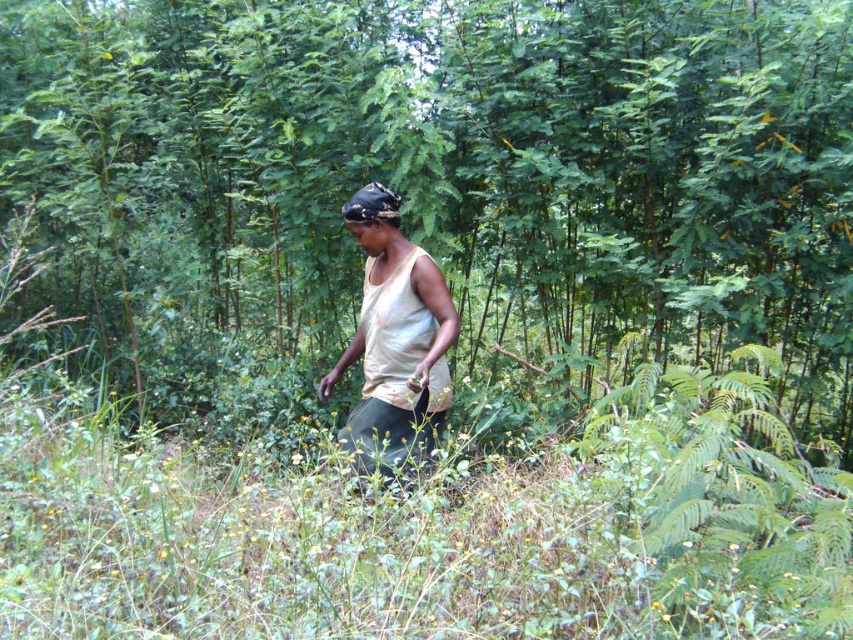
Between green leafy tree at center and white cotton tank top at center, which one is positioned higher?

green leafy tree at center is higher up.

Locate an element on the screen. green leafy tree at center is located at coordinates (450, 170).

Identify the location of green leafy tree at center. (450, 170).